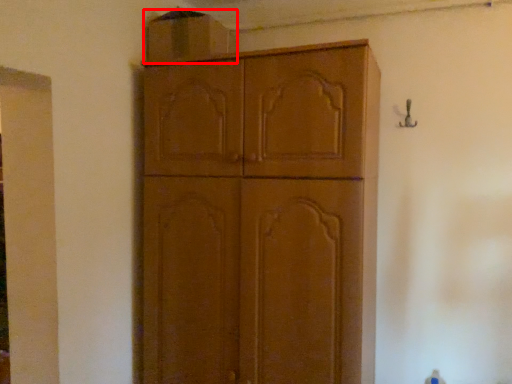
Question: Where is cabinetry (annotated by the red box) located in relation to cabinetry in the image?

Choices:
 (A) right
 (B) left

Answer: (B)